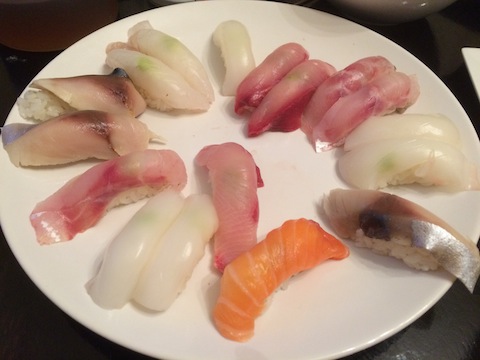
Identify the location of plate. (353, 313).